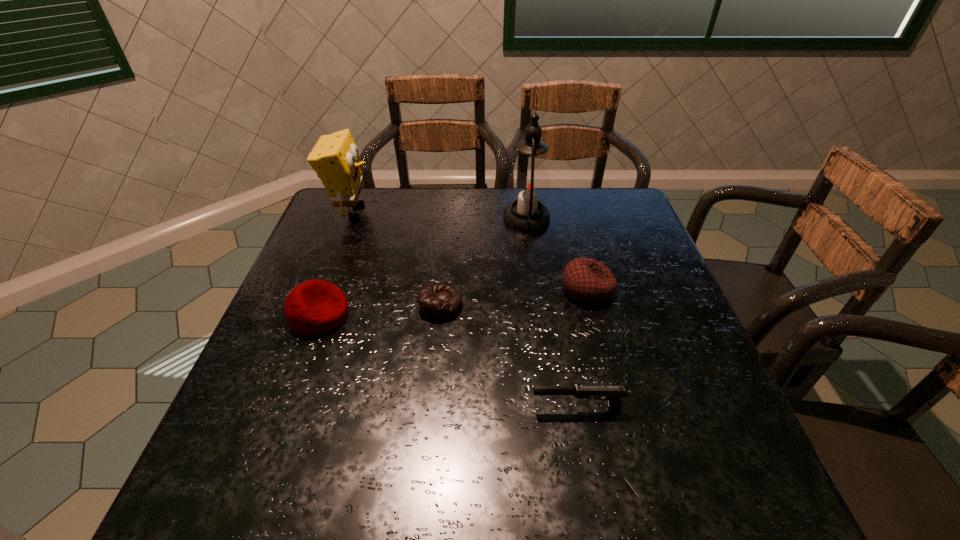
Identify the location of vacant space situated on the left of the rightmost beanbag. (500, 289).

Locate an element on the screen. free space located at the muzzle end of the nearest object is located at coordinates (505, 408).

This screenshot has width=960, height=540. I want to click on free location located 0.310m at the muzzle end of the nearest object, so click(x=369, y=408).

Locate an element on the screen. vacant area situated at the muzzle end of the nearest object is located at coordinates (358, 408).

Image resolution: width=960 pixels, height=540 pixels. In order to click on vacant space positioned 0.170m on the front of the shortest object in this screenshot , I will do `click(433, 385)`.

The width and height of the screenshot is (960, 540). Find the location of `oil lamp situated at the far edge`. oil lamp situated at the far edge is located at coordinates (529, 185).

The width and height of the screenshot is (960, 540). I want to click on sponge present at the far edge, so click(335, 158).

Identify the location of sponge situated at the left edge. (335, 158).

This screenshot has width=960, height=540. In order to click on beanbag that is at the left edge in this screenshot , I will do `click(314, 307)`.

Locate an element on the screen. The width and height of the screenshot is (960, 540). object located at the right edge is located at coordinates (586, 280).